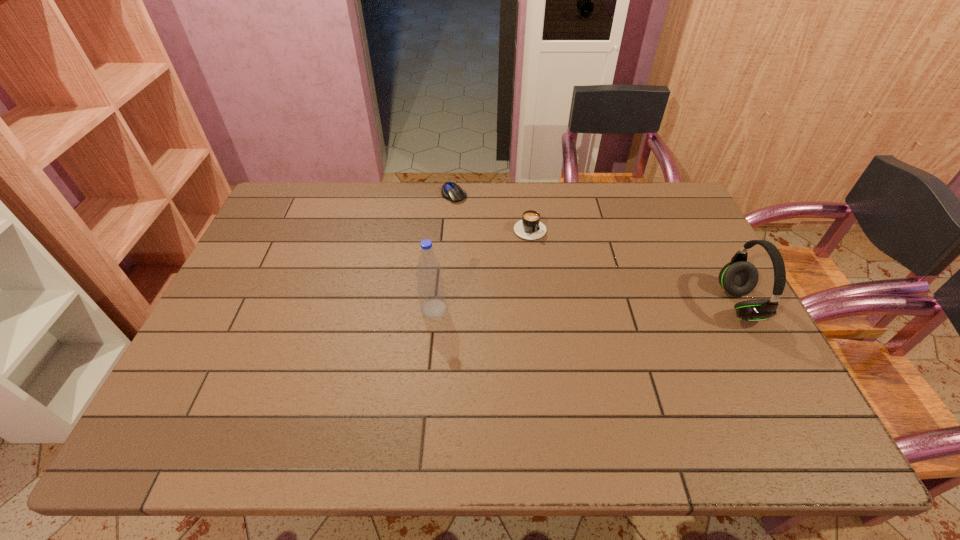
The image size is (960, 540). What are the coordinates of `vacant space at the far left corner` in the screenshot? It's located at (274, 223).

You are a GUI agent. You are given a task and a screenshot of the screen. Output one action in this format:
    pyautogui.click(x=<x>, y=<y>)
    Task: Click on the vacant space at the far right corner of the desktop
    This screenshot has height=540, width=960.
    Given the screenshot: What is the action you would take?
    pyautogui.click(x=649, y=194)

This screenshot has width=960, height=540. What are the coordinates of `unoccupied position between the second tallest object and the water bottle` in the screenshot? It's located at (587, 307).

I want to click on empty space between the third object from left to right and the water bottle, so click(481, 267).

Image resolution: width=960 pixels, height=540 pixels. Find the location of `vacant space that is in between the second object from right to left and the shortest object`. vacant space that is in between the second object from right to left and the shortest object is located at coordinates (492, 210).

At what (x,y) coordinates should I click in order to perform the action: click on free point between the third shortest object and the computer mouse. Please return your answer as a coordinate pair (x, y). This screenshot has width=960, height=540. Looking at the image, I should click on (597, 249).

Image resolution: width=960 pixels, height=540 pixels. Identify the location of free space between the tallest object and the shortest object. (444, 251).

You are a GUI agent. You are given a task and a screenshot of the screen. Output one action in this format:
    pyautogui.click(x=<x>, y=<y>)
    Task: Click on the vacant area that lies between the farthest object and the second tallest object
    
    Given the screenshot: What is the action you would take?
    pyautogui.click(x=597, y=249)

The image size is (960, 540). Find the location of `vacant area between the computer mouse and the rightmost object`. vacant area between the computer mouse and the rightmost object is located at coordinates (597, 249).

Where is `vacant area that lies between the shortest object and the water bottle`? The height and width of the screenshot is (540, 960). vacant area that lies between the shortest object and the water bottle is located at coordinates (444, 251).